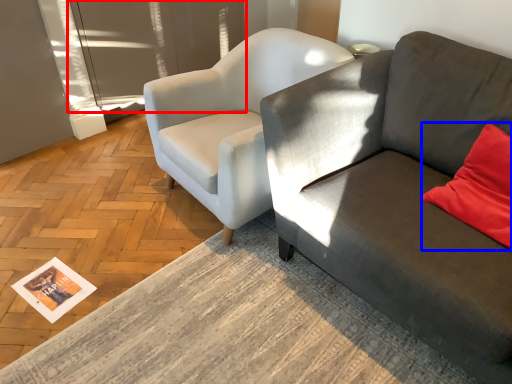
Question: Which point is closer to the camera, glass door (highlighted by a red box) or pillow (highlighted by a blue box)?

Choices:
 (A) glass door
 (B) pillow

Answer: (B)